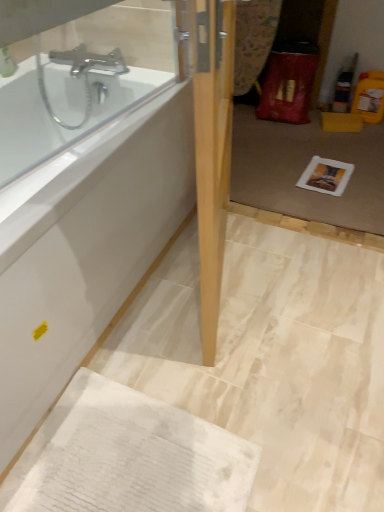
Identify the location of vacant region under white textured towel at lower left (from a real-world perspective). (137, 464).